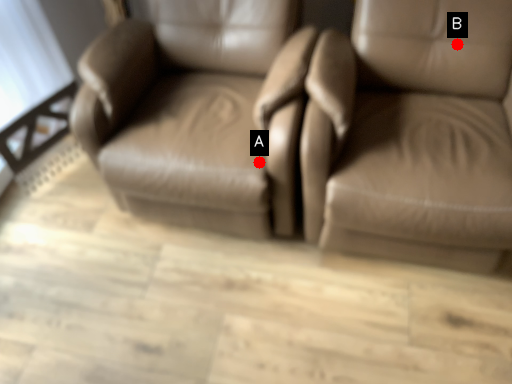
Question: Two points are circled on the image, labeled by A and B beside each circle. Which point is closer to the camera taking this photo?

Choices:
 (A) A is closer
 (B) B is closer

Answer: (A)